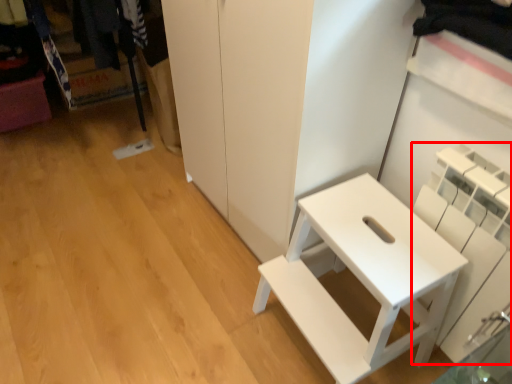
Question: Observing the image, what is the correct spatial positioning of shelf (annotated by the red box) in reference to furniture?

Choices:
 (A) right
 (B) left

Answer: (A)